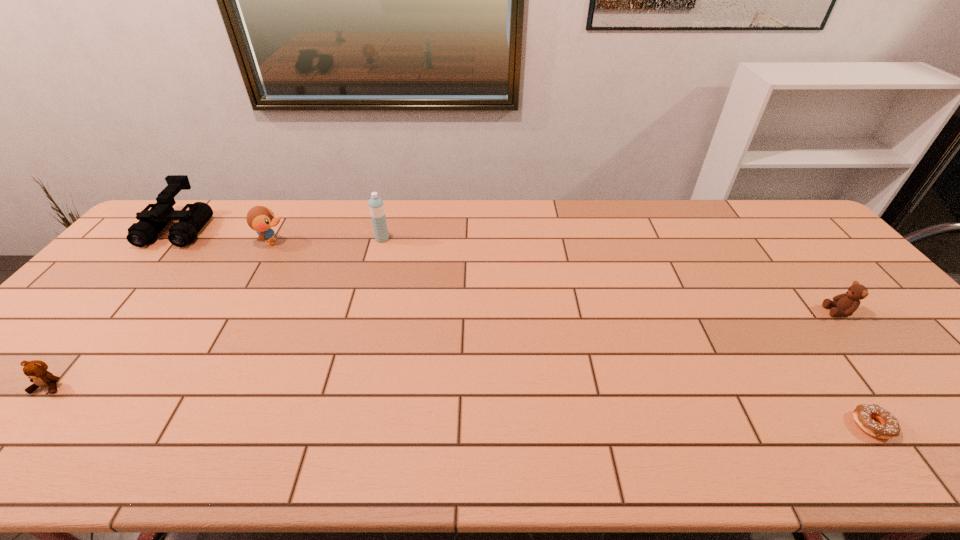
What are the coordinates of `vacant space that is in between the water bottle and the right teddy bear` in the screenshot? It's located at (611, 275).

Locate an element on the screen. The image size is (960, 540). free space between the duck and the second shortest object is located at coordinates (160, 314).

The height and width of the screenshot is (540, 960). I want to click on vacant area between the fourth farthest object and the left teddy bear, so click(x=444, y=349).

I want to click on vacant space in between the binoculars and the tallest object, so click(280, 234).

This screenshot has height=540, width=960. What are the coordinates of `vacant area that lies between the rightmost object and the shorter teddy bear` in the screenshot? It's located at (444, 349).

At what (x,y) coordinates should I click in order to perform the action: click on vacant area between the farther teddy bear and the water bottle. Please return your answer as a coordinate pair (x, y). The height and width of the screenshot is (540, 960). Looking at the image, I should click on (611, 275).

Image resolution: width=960 pixels, height=540 pixels. What are the coordinates of `vacant region between the fourth farthest object and the duck` in the screenshot? It's located at (556, 276).

Locate an element on the screen. The width and height of the screenshot is (960, 540). vacant space in between the right teddy bear and the shorter teddy bear is located at coordinates (444, 349).

The image size is (960, 540). I want to click on vacant region between the binoculars and the nearest object, so click(x=526, y=327).

In order to click on object that is the third closest one to the binoculars in this screenshot , I will do `click(376, 206)`.